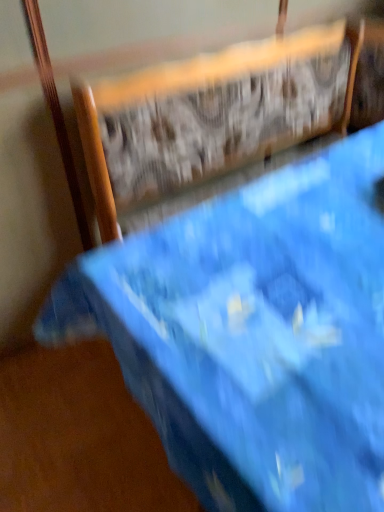
Question: Is blue fabric chair at upper center bigger or smaller than blue fabric bed at upper center?

Choices:
 (A) big
 (B) small

Answer: (B)

Question: Choose the correct answer: Is blue fabric chair at upper center inside blue fabric bed at upper center or outside it?

Choices:
 (A) outside
 (B) inside

Answer: (B)

Question: Considering the relative positions of blue fabric chair at upper center and blue fabric bed at upper center in the image provided, is blue fabric chair at upper center to the left or to the right of blue fabric bed at upper center?

Choices:
 (A) right
 (B) left

Answer: (B)

Question: Is blue fabric bed at upper center wider or thinner than blue fabric chair at upper center?

Choices:
 (A) thin
 (B) wide

Answer: (B)

Question: Is point (355, 183) positioned closer to the camera than point (193, 70)?

Choices:
 (A) farther
 (B) closer

Answer: (B)

Question: From a real-world perspective, relative to blue fabric chair at upper center, is blue fabric bed at upper center vertically above or below?

Choices:
 (A) below
 (B) above

Answer: (B)

Question: Visually, is blue fabric bed at upper center positioned to the left or to the right of blue fabric chair at upper center?

Choices:
 (A) left
 (B) right

Answer: (B)